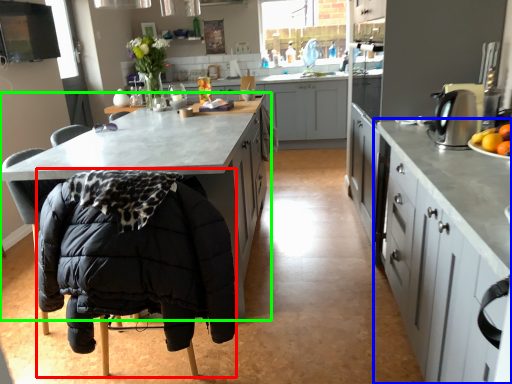
Question: Which object is the closest to the folding chair (highlighted by a red box)? Choose among these: cabinetry (highlighted by a blue box) or cabinetry (highlighted by a green box).

Choices:
 (A) cabinetry
 (B) cabinetry

Answer: (B)